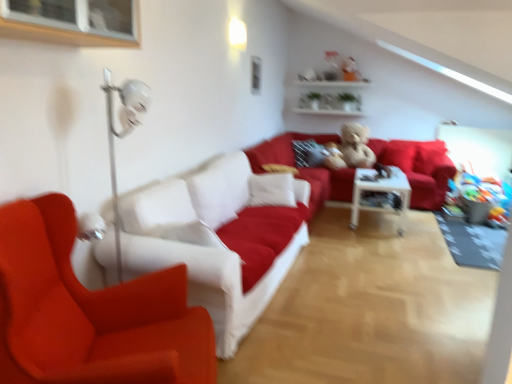
Question: Considering the relative sizes of clear glass window at upper left and fluffy beige teddy bear at center in the image provided, is clear glass window at upper left bigger than fluffy beige teddy bear at center?

Choices:
 (A) no
 (B) yes

Answer: (A)

Question: Is clear glass window at upper left next to fluffy beige teddy bear at center?

Choices:
 (A) yes
 (B) no

Answer: (B)

Question: From the image's perspective, does clear glass window at upper left appear higher than fluffy beige teddy bear at center?

Choices:
 (A) no
 (B) yes

Answer: (B)

Question: Can you confirm if clear glass window at upper left is taller than fluffy beige teddy bear at center?

Choices:
 (A) yes
 (B) no

Answer: (B)

Question: Is clear glass window at upper left positioned beyond the bounds of fluffy beige teddy bear at center?

Choices:
 (A) no
 (B) yes

Answer: (B)

Question: Is clear glass window at upper left far away from fluffy beige teddy bear at center?

Choices:
 (A) no
 (B) yes

Answer: (B)

Question: Considering the relative sizes of clear glass window at upper left and white glossy shelves at upper center in the image provided, is clear glass window at upper left bigger than white glossy shelves at upper center?

Choices:
 (A) no
 (B) yes

Answer: (A)

Question: From a real-world perspective, is clear glass window at upper left under white glossy shelves at upper center?

Choices:
 (A) no
 (B) yes

Answer: (A)

Question: Is clear glass window at upper left positioned behind white glossy shelves at upper center?

Choices:
 (A) no
 (B) yes

Answer: (A)

Question: Can you confirm if clear glass window at upper left is positioned to the right of white glossy shelves at upper center?

Choices:
 (A) yes
 (B) no

Answer: (B)

Question: Is there a large distance between clear glass window at upper left and white glossy shelves at upper center?

Choices:
 (A) no
 (B) yes

Answer: (B)

Question: Is clear glass window at upper left located outside white glossy shelves at upper center?

Choices:
 (A) no
 (B) yes

Answer: (B)

Question: Can you confirm if matte red chair at left is wider than white glossy shelves at upper center?

Choices:
 (A) yes
 (B) no

Answer: (A)